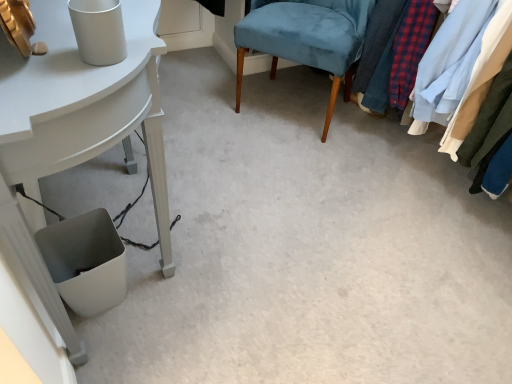
Question: From the image's perspective, is textured fabric clothes at right positioned above or below white glossy table at lower left?

Choices:
 (A) below
 (B) above

Answer: (B)

Question: In terms of height, does textured fabric clothes at right look taller or shorter compared to white glossy table at lower left?

Choices:
 (A) short
 (B) tall

Answer: (A)

Question: Which is nearer to the velvet blue chair at center?

Choices:
 (A) textured fabric clothes at right
 (B) white glossy table at lower left

Answer: (A)

Question: Considering the real-world distances, which object is closest to the textured fabric clothes at right?

Choices:
 (A) velvet blue chair at center
 (B) white glossy table at lower left

Answer: (A)